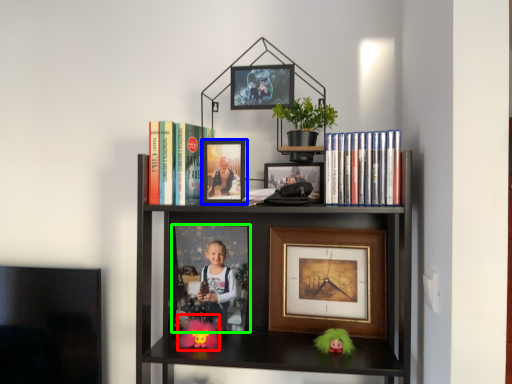
Question: Which is farther away from toy (highlighted by a red box)? picture frame (highlighted by a blue box) or picture frame (highlighted by a green box)?

Choices:
 (A) picture frame
 (B) picture frame

Answer: (A)